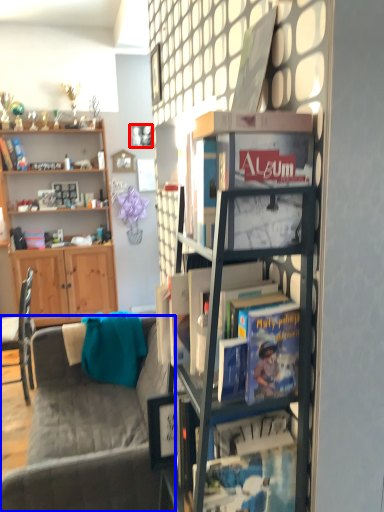
Question: Which point is closer to the camera, picture frame (highlighted by a red box) or studio couch (highlighted by a blue box)?

Choices:
 (A) picture frame
 (B) studio couch

Answer: (B)